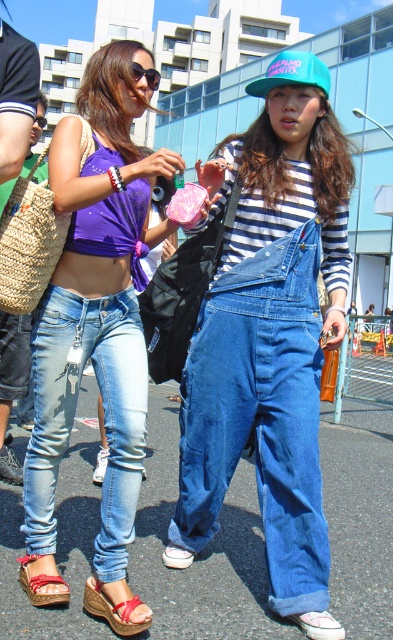
From the picture: Who is shorter, light blue denim jeans at lower left or pink fabric sandal at lower center?

Standing shorter between the two is pink fabric sandal at lower center.

Does light blue denim jeans at lower left appear on the right side of pink fabric sandal at lower center?

No, light blue denim jeans at lower left is not to the right of pink fabric sandal at lower center.

What do you see at coordinates (73, 416) in the screenshot?
I see `light blue denim jeans at lower left` at bounding box center [73, 416].

Where is `light blue denim jeans at lower left`? light blue denim jeans at lower left is located at coordinates (73, 416).

Is denim at center taller than teal matte baseball cap at center?

Yes.

Can you confirm if denim at center is smaller than teal matte baseball cap at center?

Yes, denim at center is smaller than teal matte baseball cap at center.

Where is `denim at center`? This screenshot has width=393, height=640. denim at center is located at coordinates (x=260, y=413).

At what (x,y) coordinates should I click in order to perform the action: click on denim at center. Please return your answer as a coordinate pair (x, y). Looking at the image, I should click on (260, 413).

Does point (304, 604) come farther from viewer compared to point (66, 600)?

Yes, it is.

Where is `denim at center`? The image size is (393, 640). denim at center is located at coordinates (260, 413).